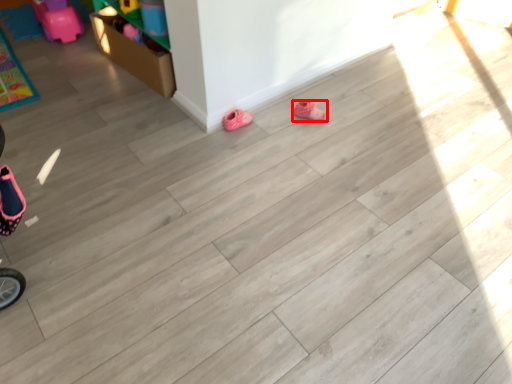
Question: From the image's perspective, where is footwear (annotated by the red box) located relative to footwear?

Choices:
 (A) above
 (B) below

Answer: (A)